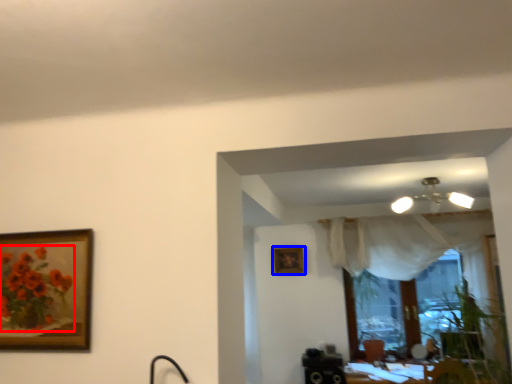
Question: Which object is closer to the camera taking this photo, flower (highlighted by a red box) or picture frame (highlighted by a blue box)?

Choices:
 (A) flower
 (B) picture frame

Answer: (A)